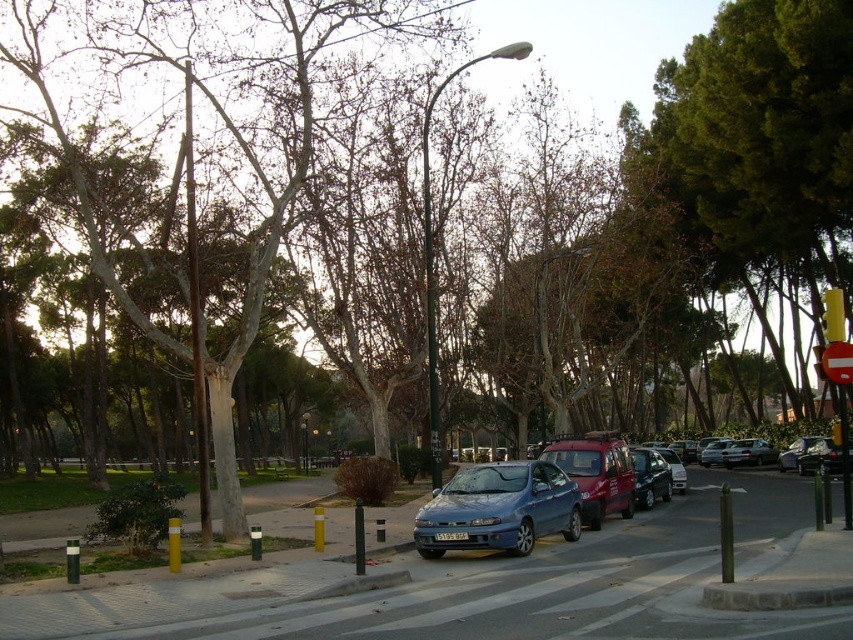
You are standing at the center of the street and want to reach the green leafy tree at upper right. Which direction should you move to get there?

The green leafy tree at upper right is located at point (761, 145), so you should move towards the upper right direction to reach it.

You are a delivery person who needs to park your metallic blue sedan at center near the green leafy tree at upper right. Considering the size of the tree, do you think there is enough space between the tree and the sedan to park safely?

The green leafy tree at upper right is larger than the metallic blue sedan at center, so there should be enough space between them to park safely.